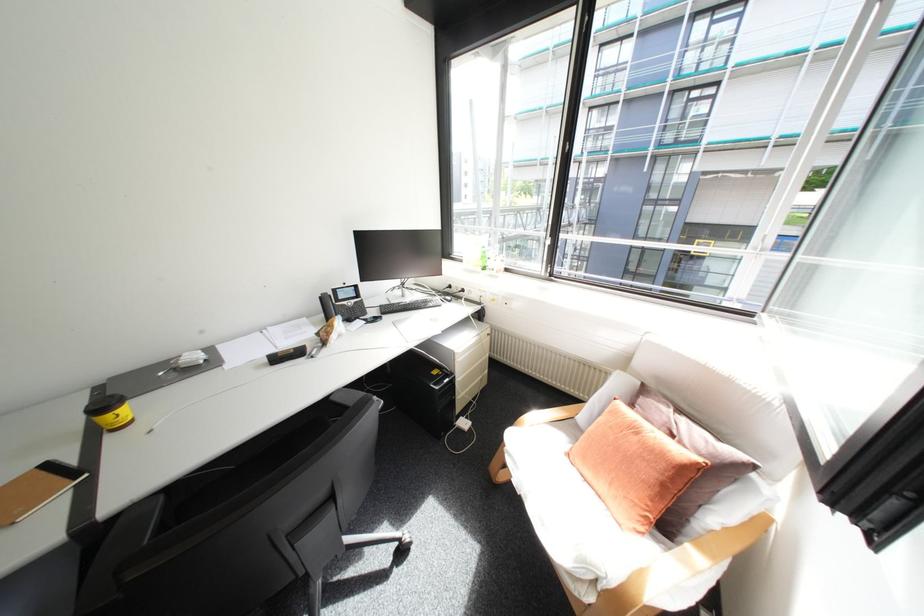
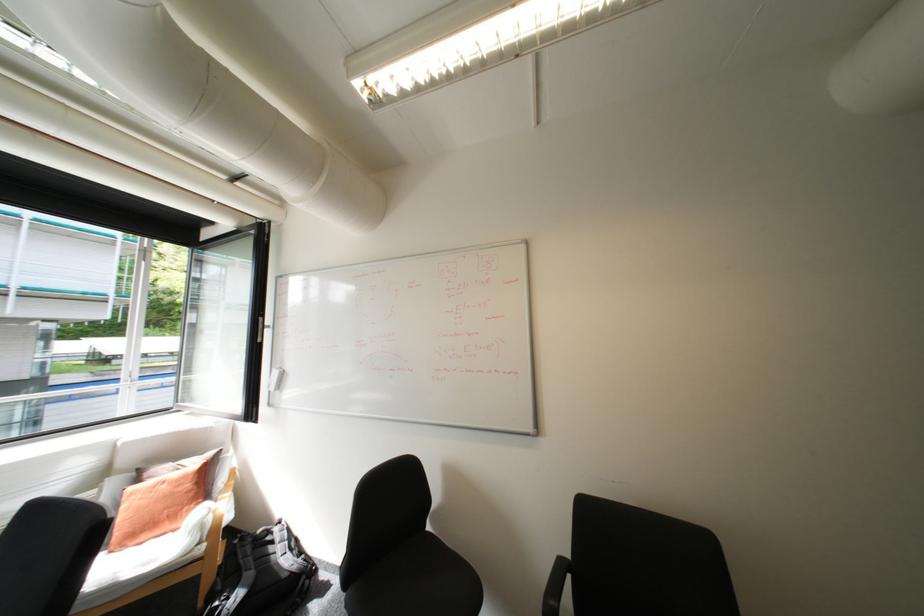
Where in the second image is the point corresponding to point (578, 455) from the first image?

(122, 552)